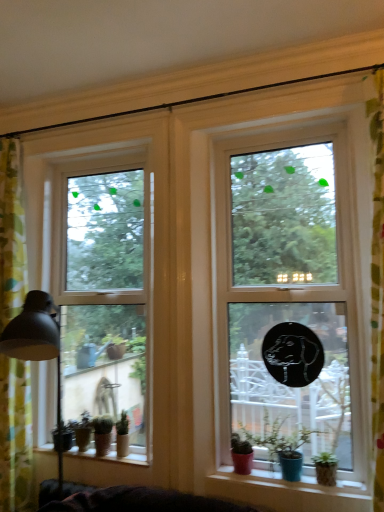
Image resolution: width=384 pixels, height=512 pixels. Find the location of `vacant area on top of matte ceramic pots at lower center, marked as the second window sill in a left-to-right arrangement (from a real-world perspective)`. vacant area on top of matte ceramic pots at lower center, marked as the second window sill in a left-to-right arrangement (from a real-world perspective) is located at coordinates (306, 478).